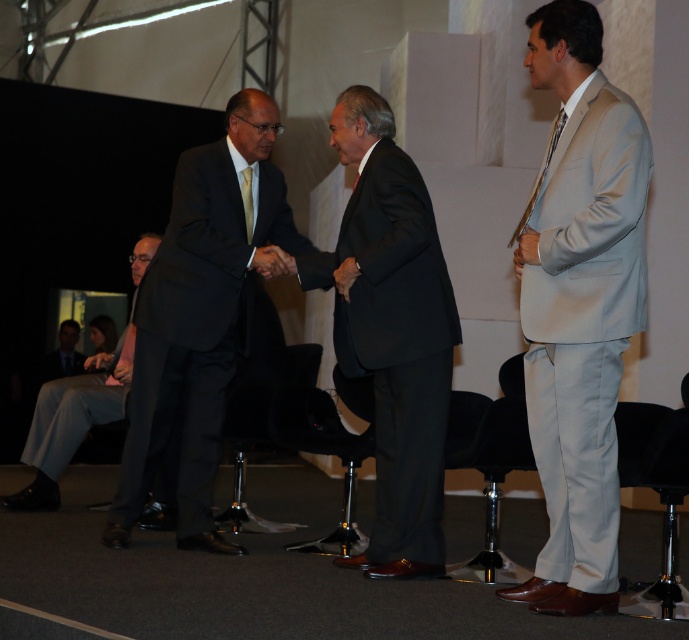
In the image of the formal event, there are two men shaking hands and a third man observing. Which object labeled as the black matte suit at center is located at the coordinate point 0.519, 0.569?

The black matte suit at center is located at the coordinate point (391, 332).

You are at the point marked by coordinates point (169, 276) and want to walk towards the point marked by coordinates point (50, 372). Will you pass in front of or behind the third man who is observing the handshake?

Since point (169, 276) is in front of point (50, 372), walking from point (169, 276) to point (50, 372) would mean you are moving towards the third man. Therefore, you would pass in front of the third man observing the handshake.

You are attending a formal event and want to locate the light gray suit at right. According to the coordinates provided, where should you look in the image?

You should look at the coordinates point (579, 305) to locate the light gray suit at right.